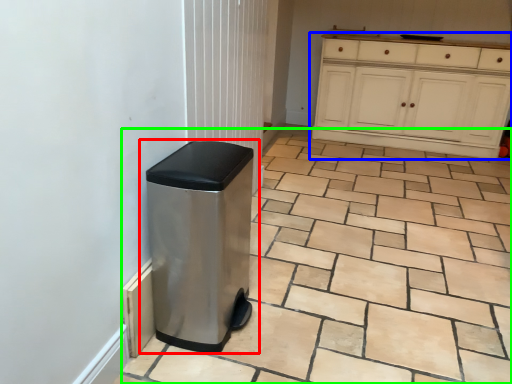
Question: Which object is positioned closest to waste container (highlighted by a red box)? Select from cabinetry (highlighted by a blue box) and ceramic tile (highlighted by a green box).

Choices:
 (A) cabinetry
 (B) ceramic tile

Answer: (B)